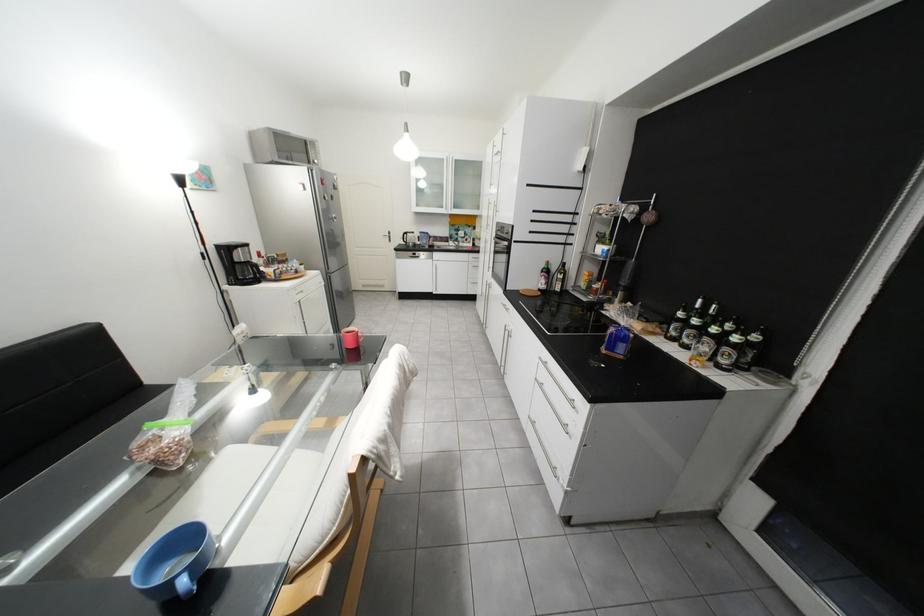
Find where to grasp the blue cup handle. Please return your answer as a coordinate pair (x, y).

(184, 584)